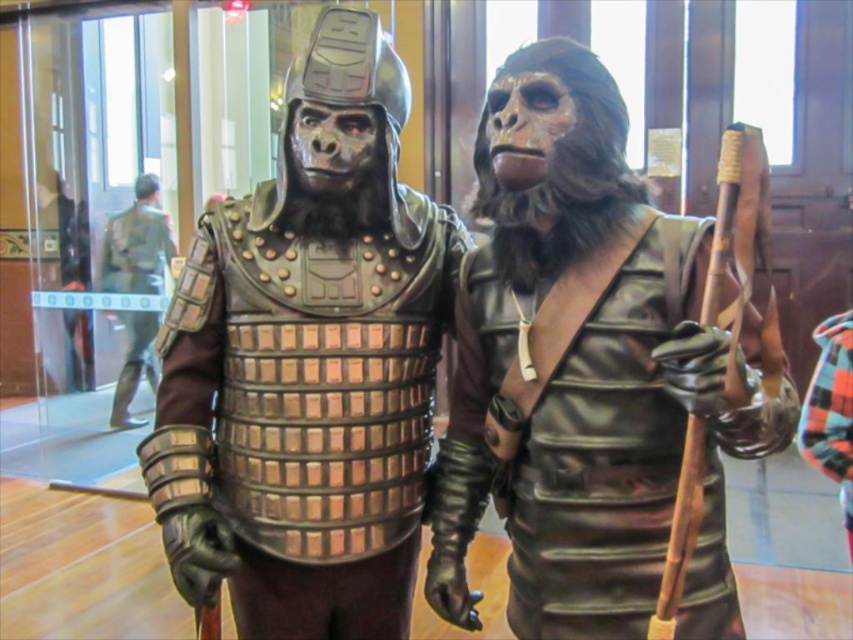
How much distance is there between metallic armor at center and leather-like armor at center?

metallic armor at center is 10.95 inches from leather-like armor at center.

Is the position of metallic armor at center more distant than that of leather-like armor at center?

That is True.

Which is in front, point (413, 216) or point (724, 586)?

Point (724, 586) is in front.

The image size is (853, 640). Find the location of `metallic armor at center`. metallic armor at center is located at coordinates (308, 364).

Does metallic armor at center have a lesser width compared to brushed metal armor at left?

In fact, metallic armor at center might be wider than brushed metal armor at left.

Measure the distance from metallic armor at center to brushed metal armor at left.

A distance of 3.06 meters exists between metallic armor at center and brushed metal armor at left.

In order to click on metallic armor at center in this screenshot , I will do `click(308, 364)`.

Can you confirm if leather-like armor at center is wider than brushed metal armor at left?

Incorrect, leather-like armor at center's width does not surpass brushed metal armor at left's.

Is point (654, 403) behind point (109, 289)?

No, it is not.

The width and height of the screenshot is (853, 640). Identify the location of leather-like armor at center. (583, 372).